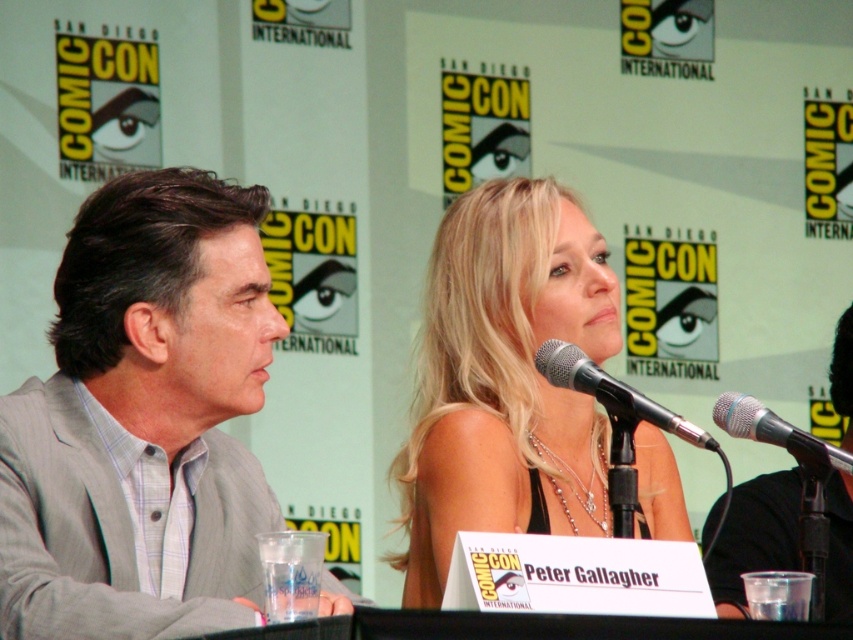
Does point (93, 234) come farther from viewer compared to point (566, 349)?

That is True.

The height and width of the screenshot is (640, 853). Find the location of `gray pinstriped suit at left`. gray pinstriped suit at left is located at coordinates (143, 420).

Is point (218, 308) positioned behind point (560, 385)?

That is True.

The image size is (853, 640). I want to click on gray pinstriped suit at left, so tap(143, 420).

Is blonde hair at center smaller than black matte microphone at center?

No, blonde hair at center is not smaller than black matte microphone at center.

Is point (570, 477) positioned behind point (727, 618)?

Yes, point (570, 477) is farther from viewer.

Between point (585, 232) and point (846, 497), which one is positioned in front?

Point (585, 232)

This screenshot has height=640, width=853. What are the coordinates of `blonde hair at center` in the screenshot? It's located at click(x=505, y=380).

Between black metallic microphone at center and black matte microphone at center, which one is positioned higher?

Positioned higher is black metallic microphone at center.

Can you confirm if black metallic microphone at center is bigger than black matte microphone at center?

Actually, black metallic microphone at center might be smaller than black matte microphone at center.

The height and width of the screenshot is (640, 853). What do you see at coordinates (612, 392) in the screenshot?
I see `black metallic microphone at center` at bounding box center [612, 392].

At what (x,y) coordinates should I click in order to perform the action: click on black metallic microphone at center. Please return your answer as a coordinate pair (x, y). This screenshot has height=640, width=853. Looking at the image, I should click on (612, 392).